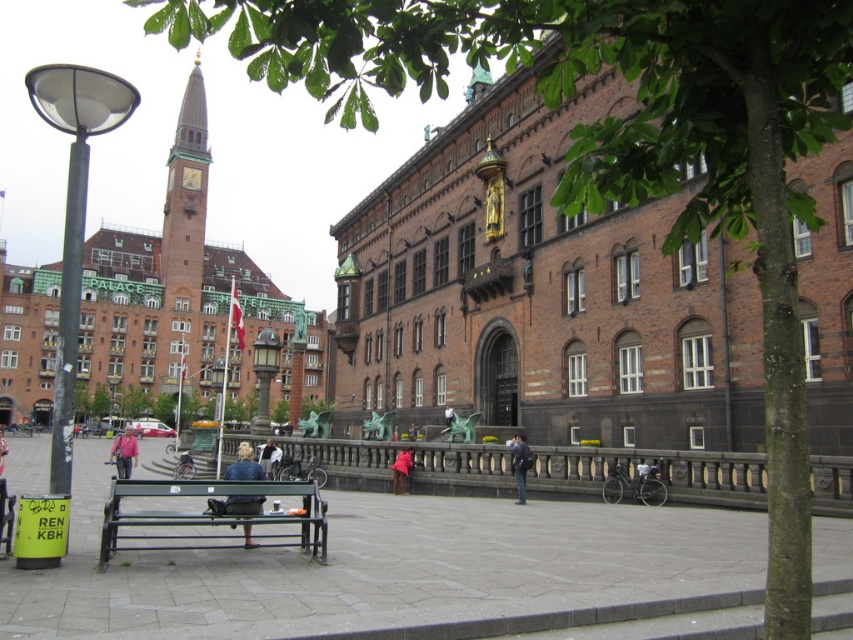
You are a photographer planning to capture the historic building with its golden statue and the people in the square. You notice the polished brass lamp post at center and the denim jacket at center. Which object would block a wider portion of your camera frame if placed between the camera and the building?

The polished brass lamp post at center would block a wider portion of the camera frame because its width is larger than the denim jacket at center.

You are standing in the square and see both the denim jacket at center and the light brown leather jacket at center. Which jacket is positioned to the right?

The light brown leather jacket at center is positioned to the right of the denim jacket at center.

You are a photographer setting up a tripod in the square. You need to position it so that both the metallic green bench at center and the denim jacket at center are visible in the frame. Considering their heights, which object should you adjust your camera angle to focus on first to ensure both are in view?

The metallic green bench at center is much taller than the denim jacket at center, so you should first adjust your camera angle to include the taller bench, then ensure the jacket is visible within the same frame.